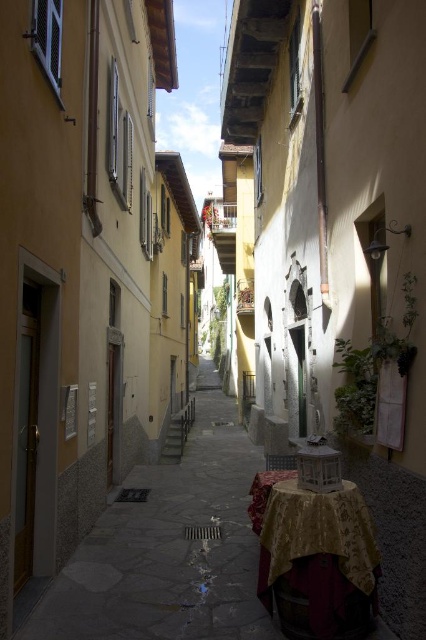
Between smooth stone path at center and gold textured tablecloth at lower right, which one has more height?

smooth stone path at center

Which is more to the left, smooth stone path at center or gold textured tablecloth at lower right?

Positioned to the left is smooth stone path at center.

The width and height of the screenshot is (426, 640). Identify the location of smooth stone path at center. (169, 547).